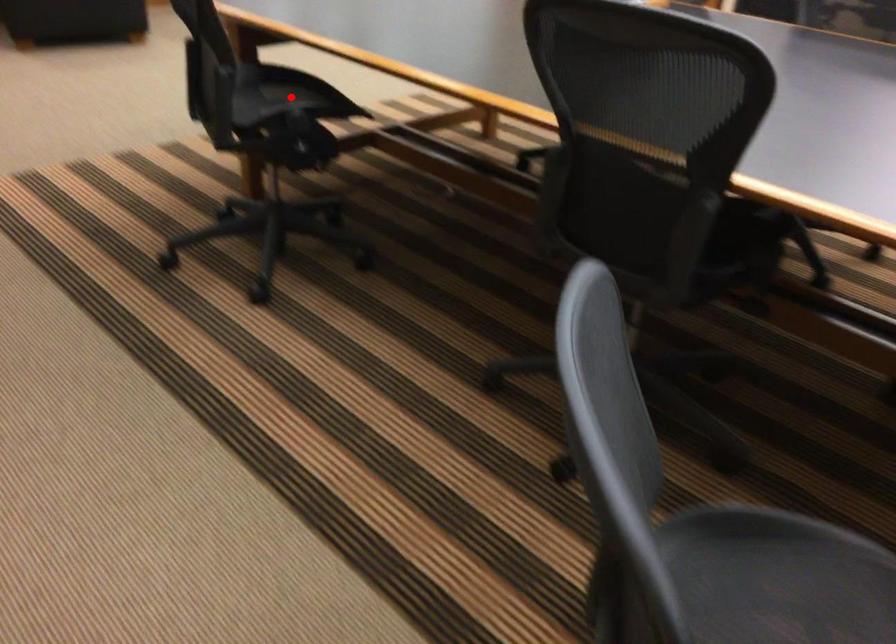
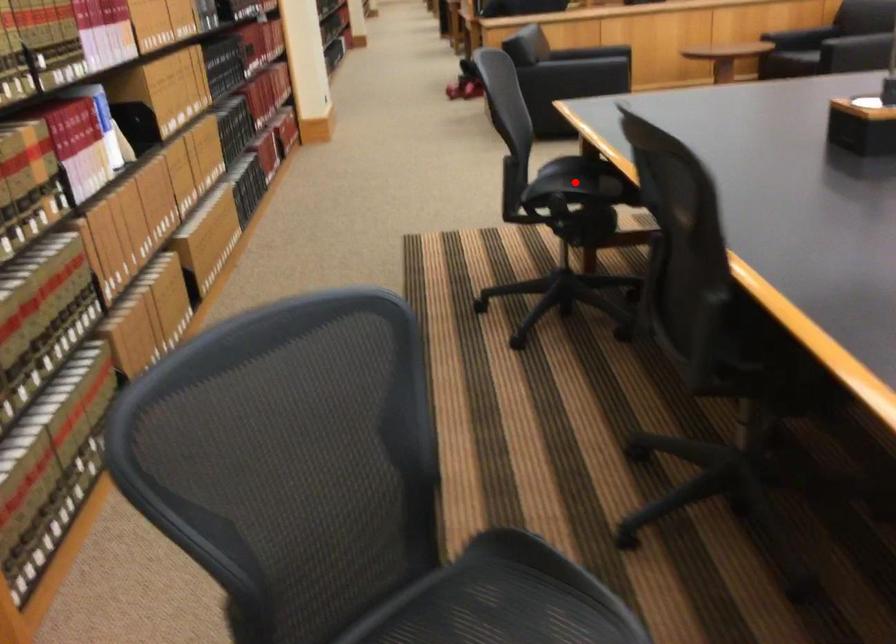
I am providing you with two images of the same scene from different viewpoints. A red point is marked on the first image and another point is marked on the second image. Do the highlighted points in image1 and image2 indicate the same real-world spot?

Yes